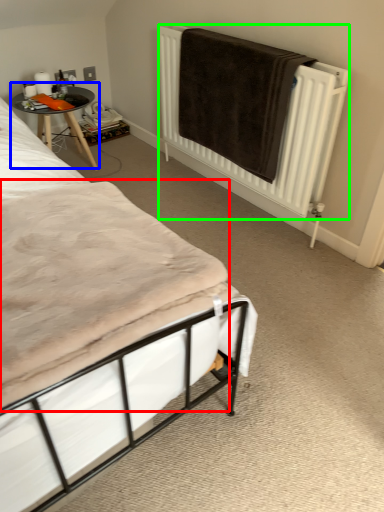
Question: Which object is positioned closest to mattress (highlighted by a red box)? Select from table (highlighted by a blue box) and radiator (highlighted by a green box).

Choices:
 (A) table
 (B) radiator

Answer: (B)